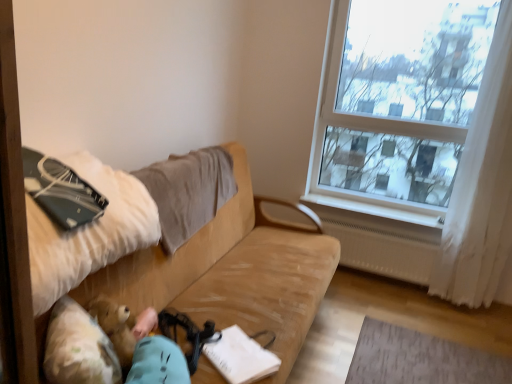
Locate an element on the screen. free region on the left part of white sheer curtain at right is located at coordinates (410, 304).